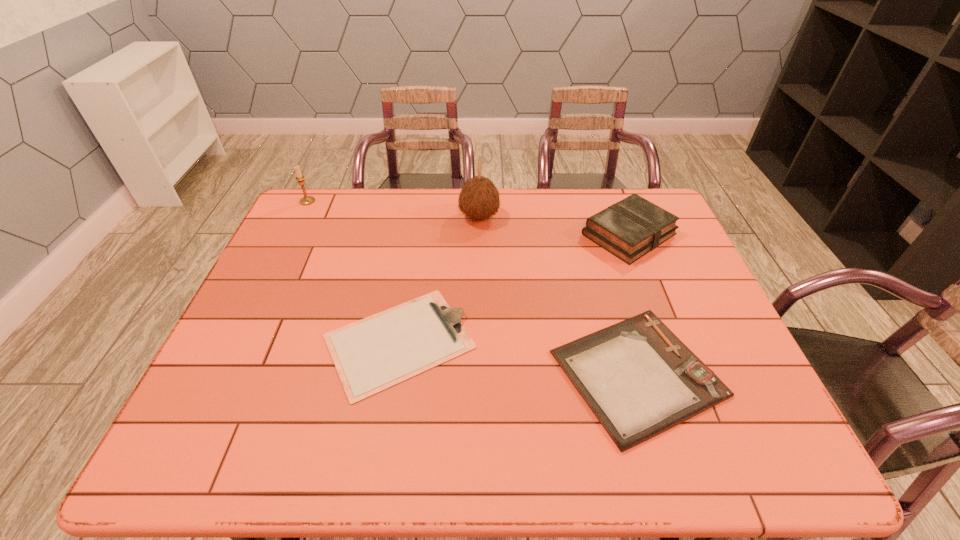
At what (x,y) coordinates should I click in order to perform the action: click on object that is at the near right corner. Please return your answer as a coordinate pair (x, y). This screenshot has width=960, height=540. Looking at the image, I should click on (639, 379).

In order to click on free space at the far edge of the desktop in this screenshot , I will do `click(457, 204)`.

The image size is (960, 540). Find the location of `free space at the left edge of the desktop`. free space at the left edge of the desktop is located at coordinates (213, 397).

Identify the location of vacant space at the right edge. Image resolution: width=960 pixels, height=540 pixels. (704, 329).

I want to click on blank space at the far left corner, so click(303, 213).

Identify the location of blank region between the tallest object and the right clipboard. (559, 295).

You are a GUI agent. You are given a task and a screenshot of the screen. Output one action in this format:
    pyautogui.click(x=<x>, y=<y>)
    Task: Click on the vacant space in between the right clipboard and the tallest object
    
    Given the screenshot: What is the action you would take?
    pyautogui.click(x=559, y=295)

The image size is (960, 540). What are the coordinates of `free space that is in between the tallest object and the left clipboard` in the screenshot? It's located at (440, 279).

Where is `empty space that is in between the coconut and the left clipboard`? Image resolution: width=960 pixels, height=540 pixels. empty space that is in between the coconut and the left clipboard is located at coordinates (440, 279).

Where is `empty location between the coconut and the left clipboard`? empty location between the coconut and the left clipboard is located at coordinates (440, 279).